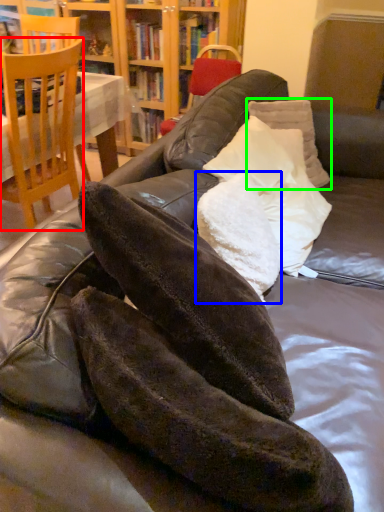
Question: Considering the real-world distances, which object is farthest from chair (highlighted by a red box)? pillow (highlighted by a blue box) or pillow (highlighted by a green box)?

Choices:
 (A) pillow
 (B) pillow

Answer: (A)